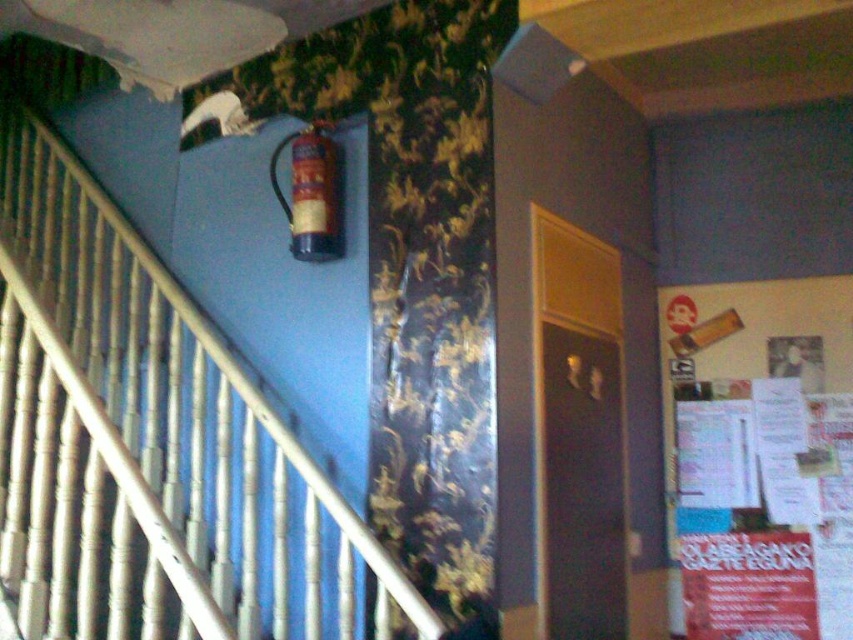
Question: Where is white matte railing at upper left located in relation to metallic gold extinguisher at upper center in the image?

Choices:
 (A) left
 (B) right

Answer: (A)

Question: Which object is positioned farthest from the white matte railing at upper left?

Choices:
 (A) metallic gold extinguisher at upper center
 (B) white paper poster at right

Answer: (B)

Question: Which is farther from the white matte railing at upper left?

Choices:
 (A) white paper poster at right
 (B) metallic gold extinguisher at upper center

Answer: (A)

Question: Does white matte railing at upper left have a larger size compared to metallic gold extinguisher at upper center?

Choices:
 (A) yes
 (B) no

Answer: (A)

Question: Estimate the real-world distances between objects in this image. Which object is closer to the white paper poster at right?

Choices:
 (A) metallic gold extinguisher at upper center
 (B) white matte railing at upper left

Answer: (A)

Question: Is white matte railing at upper left positioned before metallic gold extinguisher at upper center?

Choices:
 (A) yes
 (B) no

Answer: (A)